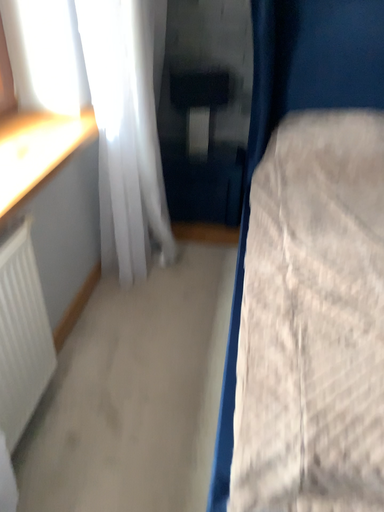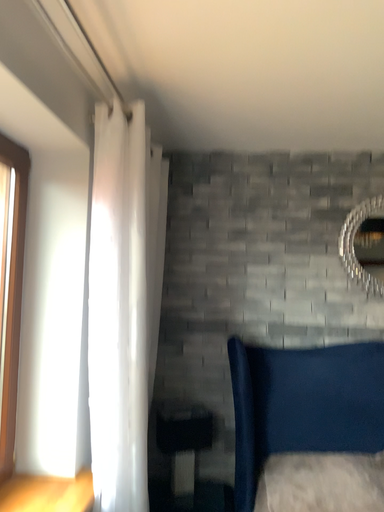
Question: Which way did the camera rotate in the video?

Choices:
 (A) rotated upward
 (B) rotated downward

Answer: (A)